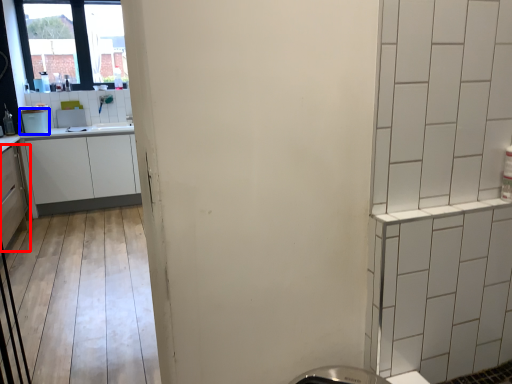
Question: Which of the following is the farthest to the observer, cabinetry (highlighted by a red box) or appliance (highlighted by a blue box)?

Choices:
 (A) cabinetry
 (B) appliance

Answer: (B)